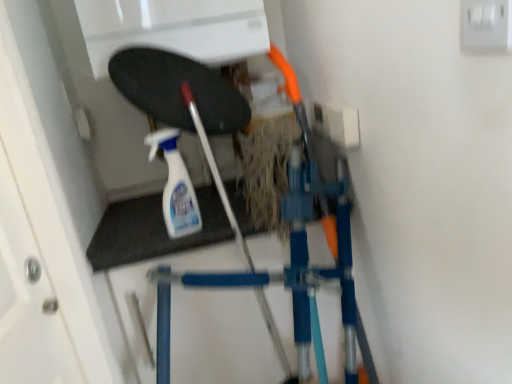
The image size is (512, 384). In order to click on vacant position to the left of clear plastic spray bottle at center in this screenshot , I will do `click(137, 237)`.